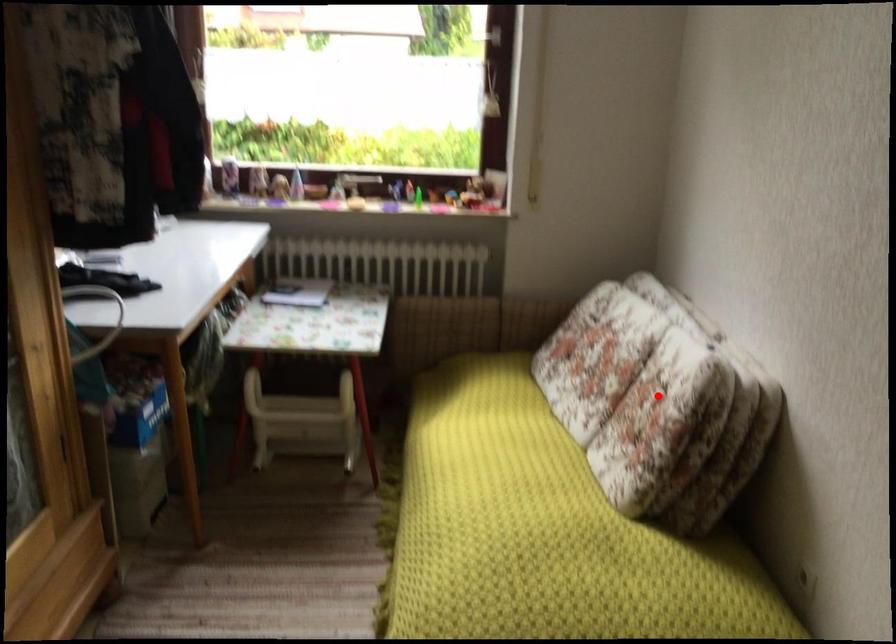
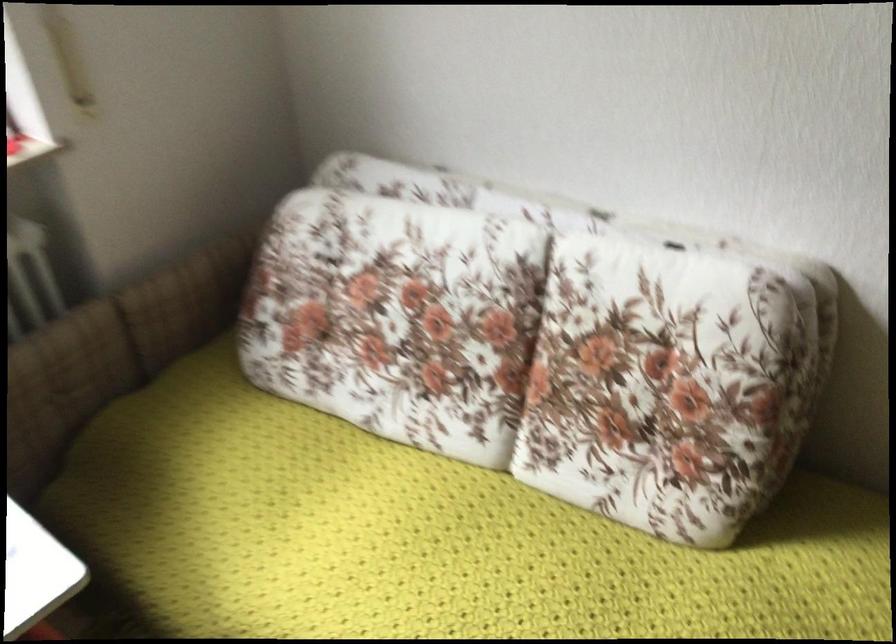
In the second image, find the point that corresponds to the highlighted location in the first image.

(650, 359)